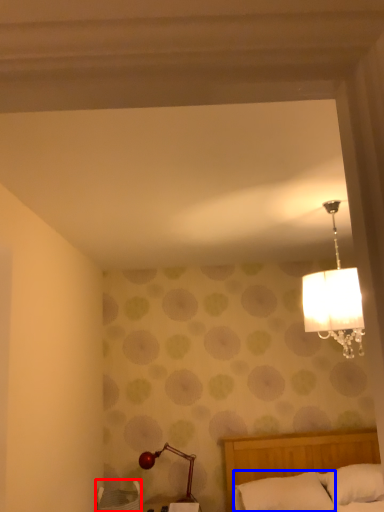
Question: Which point is closer to the camera, furniture (highlighted by a red box) or pillow (highlighted by a blue box)?

Choices:
 (A) furniture
 (B) pillow

Answer: (B)